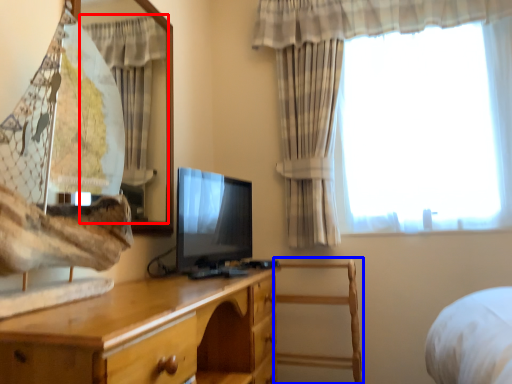
Question: Among these objects, which one is farthest to the camera, curtain (highlighted by a red box) or chair (highlighted by a blue box)?

Choices:
 (A) curtain
 (B) chair

Answer: (B)